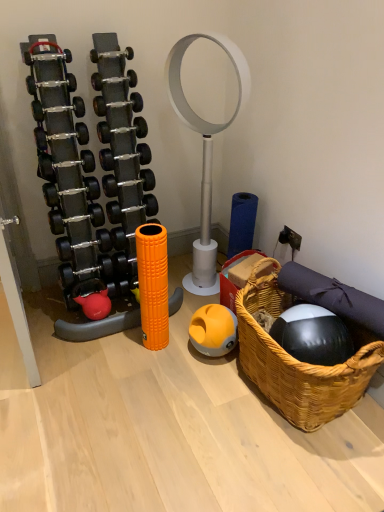
Where is `vacant area in front of orange rubber ball at center`? vacant area in front of orange rubber ball at center is located at coordinates (215, 382).